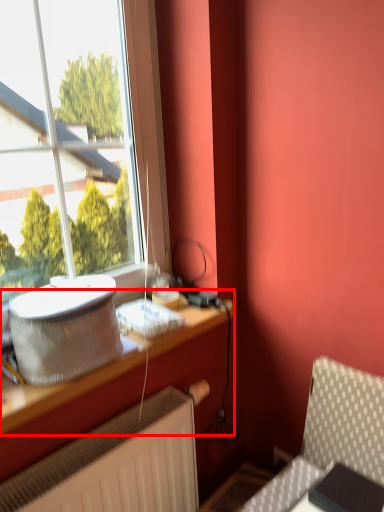
Question: In this image, where is table (annotated by the red box) located relative to appliance?

Choices:
 (A) left
 (B) right

Answer: (B)